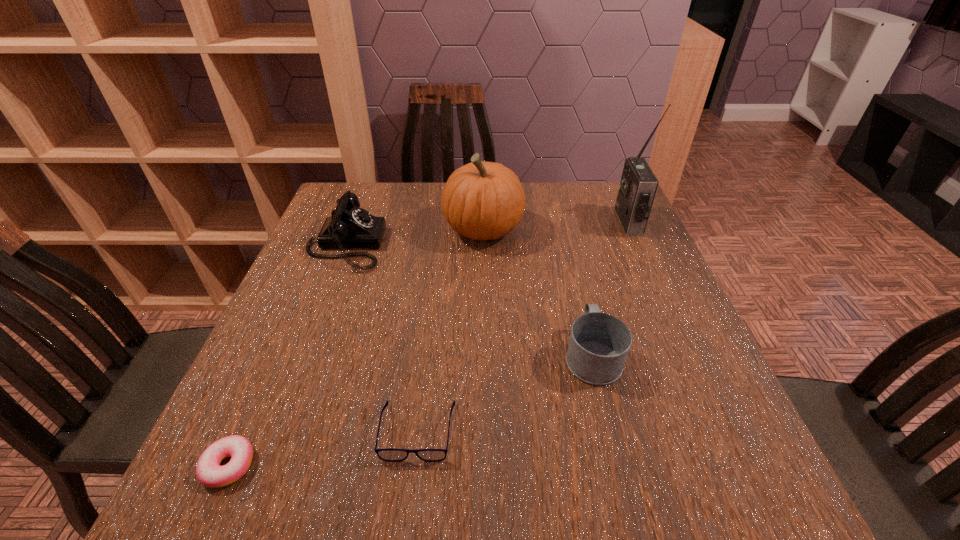
Locate an element on the screen. The width and height of the screenshot is (960, 540). vacant point located between the doughnut and the third nearest object is located at coordinates (411, 410).

Locate an element on the screen. The image size is (960, 540). free space between the doughnut and the telephone is located at coordinates (287, 355).

Image resolution: width=960 pixels, height=540 pixels. I want to click on empty space between the second object from right to left and the doughnut, so click(x=411, y=410).

Where is `free area in between the spectacles and the third tallest object`? The image size is (960, 540). free area in between the spectacles and the third tallest object is located at coordinates (382, 338).

At what (x,y) coordinates should I click in order to perform the action: click on empty space between the pumpkin and the third shortest object. Please return your answer as a coordinate pair (x, y). The width and height of the screenshot is (960, 540). Looking at the image, I should click on (538, 292).

At what (x,y) coordinates should I click in order to perform the action: click on vacant space that's between the fourth shortest object and the shortest object. Please return your answer as a coordinate pair (x, y). This screenshot has height=540, width=960. Looking at the image, I should click on coord(287,355).

Identify which object is located as the nearest to the fifth object from left to right. Please provide its 2D coordinates. Your answer should be formatted as a tuple, i.e. [(x, y)], where the tuple contains the x and y coordinates of a point satisfying the conditions above.

[(391, 455)]

Locate an element on the screen. This screenshot has height=540, width=960. object that ranks as the second closest to the rightmost object is located at coordinates (599, 343).

I want to click on vacant area in the image that satisfies the following two spatial constraints: 1. on the stem of the second tallest object; 2. on the side of the third nearest object with the handle, so point(484,355).

Locate an element on the screen. free point that satisfies the following two spatial constraints: 1. on the stem of the pumpkin; 2. on the front-facing side of the spectacles is located at coordinates (x=485, y=431).